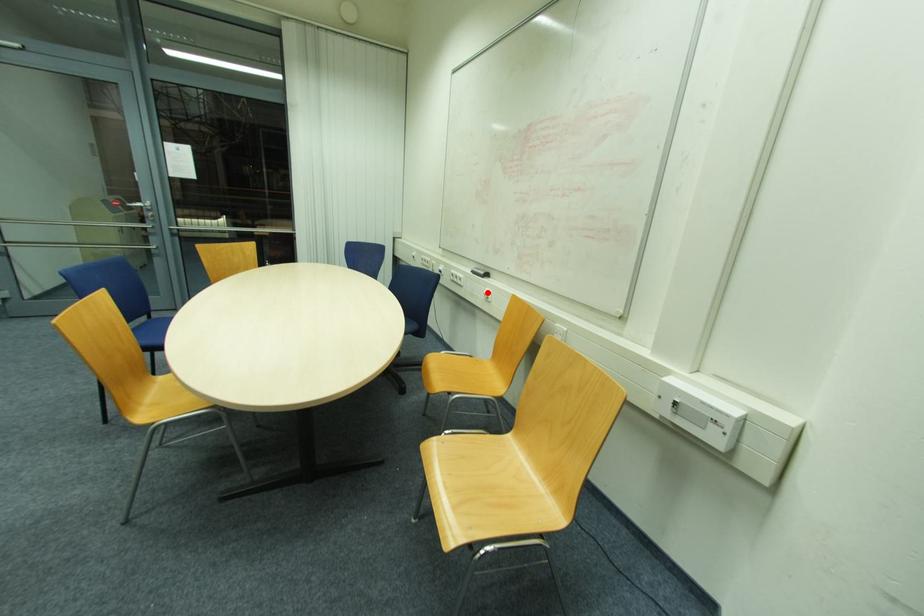
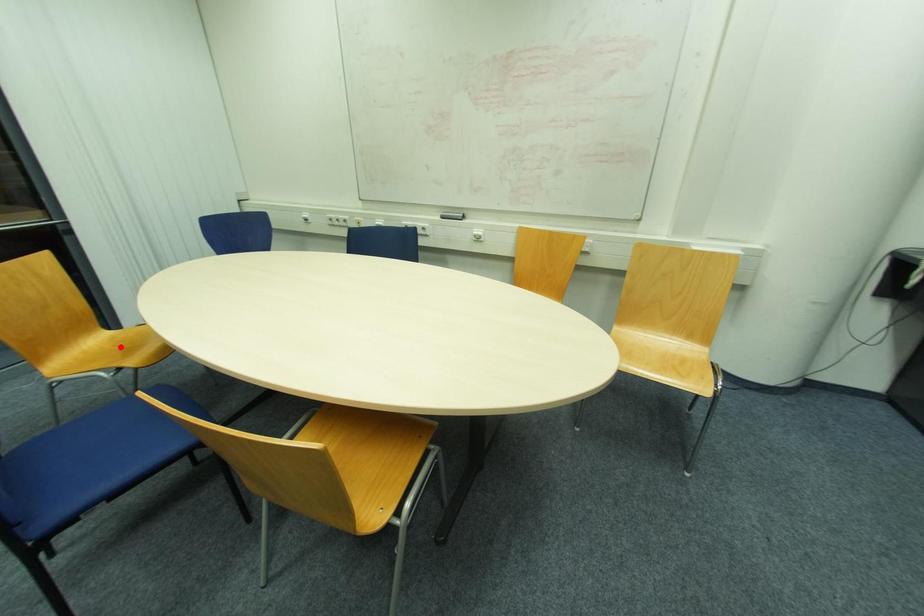
I am providing you with two images of the same scene from different viewpoints. A red point is marked on the first image and another point is marked on the second image. Does the point marked in image1 correspond to the same location as the one in image2?

No